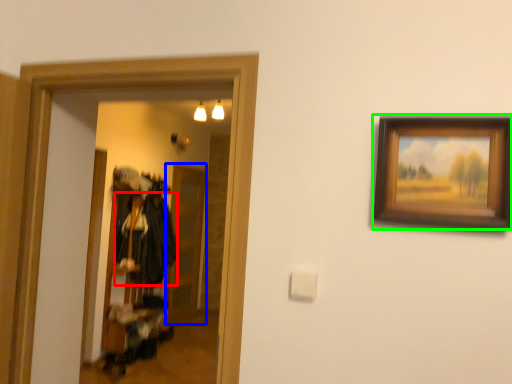
Question: Which object is positioned farthest from clothing (highlighted by a red box)? Select from glass door (highlighted by a blue box) and picture frame (highlighted by a green box).

Choices:
 (A) glass door
 (B) picture frame

Answer: (B)